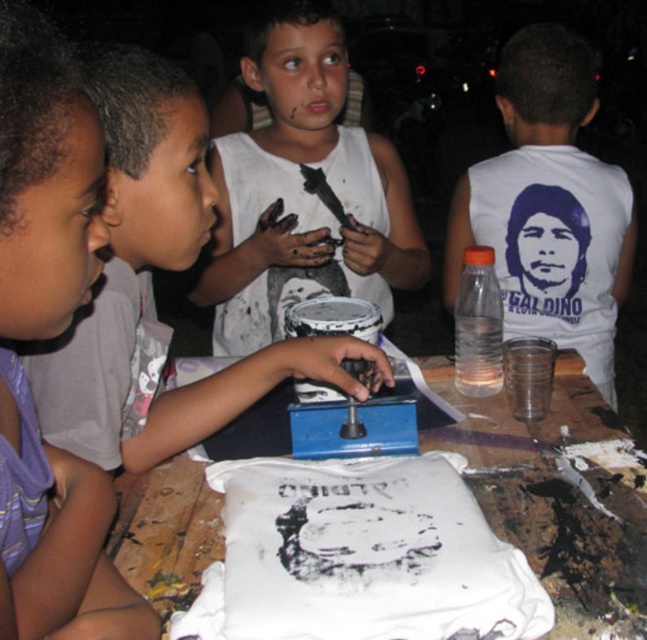
Question: Which of the following is the farthest from the observer?

Choices:
 (A) purple fabric shirt at left
 (B) white paper at center
 (C) matte white shirt at center

Answer: (C)

Question: Which point is closer to the camera?

Choices:
 (A) (168, 444)
 (B) (201, 547)

Answer: (B)

Question: Among these points, which one is farthest from the camera?

Choices:
 (A) (0, 113)
 (B) (142, 566)
 (C) (488, 620)
 (D) (551, 188)

Answer: (D)

Question: Does white matte t-shirt at center have a lesser width compared to purple fabric shirt at left?

Choices:
 (A) yes
 (B) no

Answer: (B)

Question: Does white paper at center appear under white matte shirt at center?

Choices:
 (A) no
 (B) yes

Answer: (B)

Question: Is purple fabric shirt at left further to camera compared to matte white shirt at center?

Choices:
 (A) no
 (B) yes

Answer: (A)